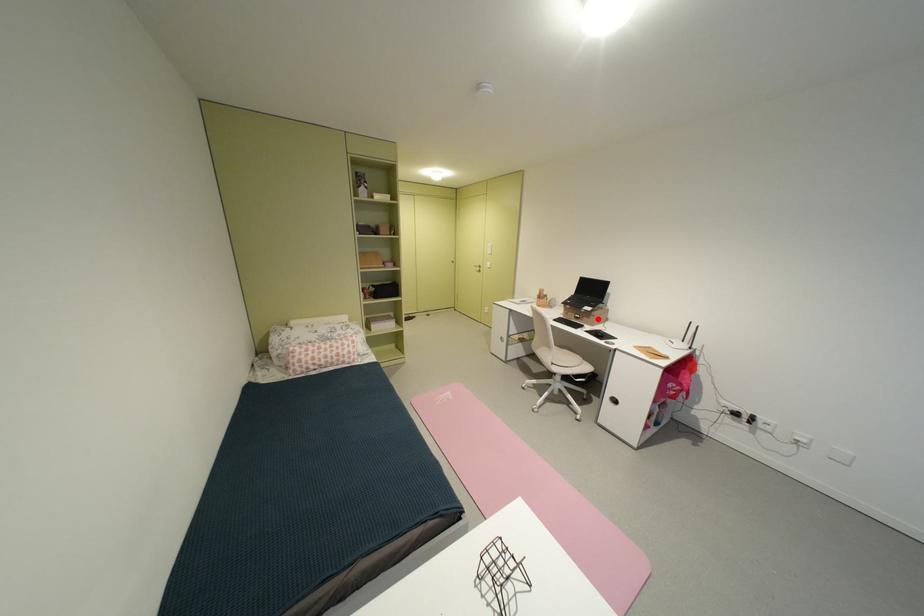
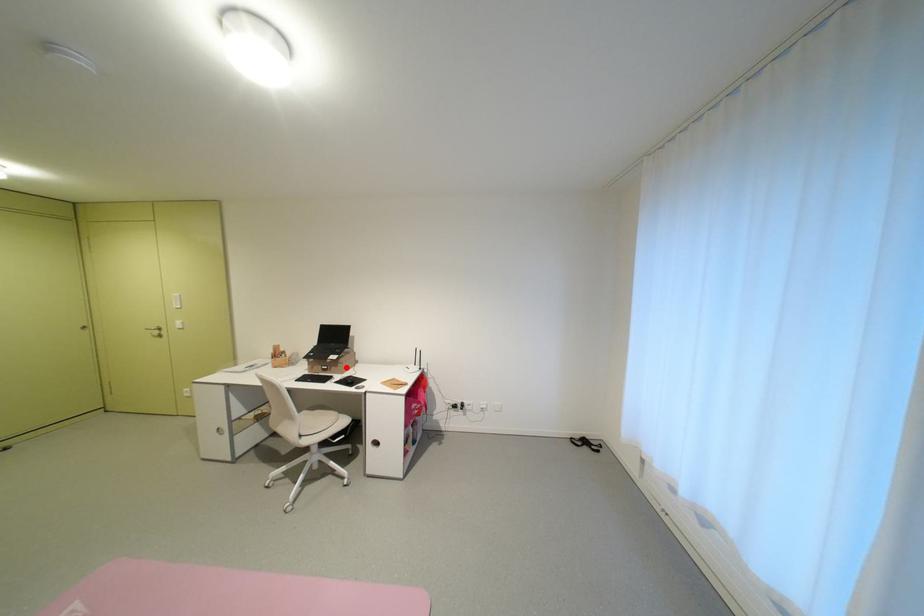
I am providing you with two images of the same scene from different viewpoints. A red point is marked on the first image and another point is marked on the second image. Do the highlighted points in image1 and image2 indicate the same real-world spot?

Yes